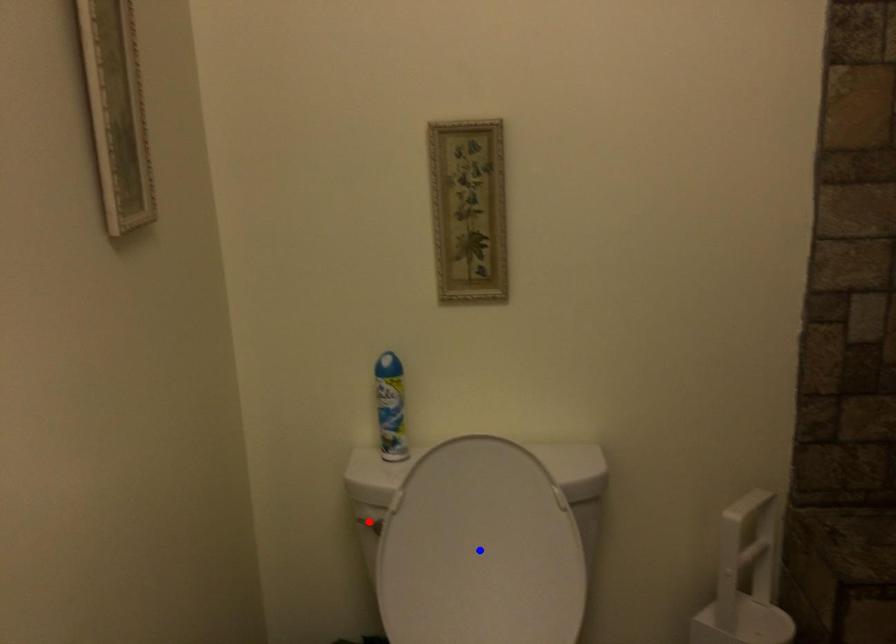
Question: Which of the two points in the image is closer to the camera?

Choices:
 (A) Blue point is closer.
 (B) Red point is closer.

Answer: (A)